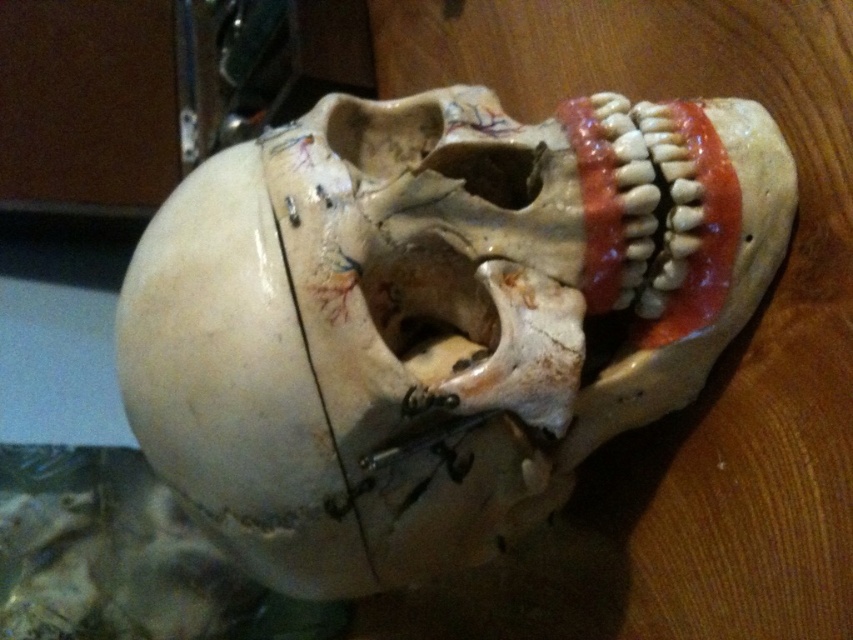
You are a dentist who needs to place the smooth porcelain teeth at right into the white matte skull at center. Can you do it without moving the skull? The minimum required distance for placement is 8 inches.

The distance between the white matte skull at center and smooth porcelain teeth at right is 7.91 inches, which is less than the required 8 inches. Therefore, you cannot place the smooth porcelain teeth at right into the white matte skull at center without moving the skull.

You are a dentist examining a patient. You notice the white matte skull at center and the smooth porcelain teeth at right in your office. Which object is bigger in size?

The white matte skull at center has a larger size compared to the smooth porcelain teeth at right, so the white matte skull at center is bigger.

You are a forensic artist analyzing the image of a skull. You notice a specific point at coordinates (434, 316). Based on the scene description, what object is located at that point?

The point at coordinates (434, 316) is on the white matte skull at center.